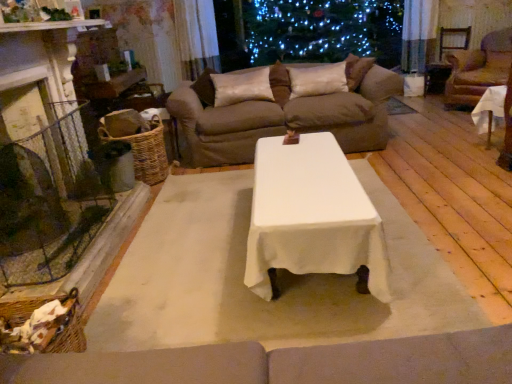
Measure the distance between brown fabric couch at upper center and camera.

brown fabric couch at upper center and camera are 11.69 feet apart.

The height and width of the screenshot is (384, 512). What do you see at coordinates (146, 153) in the screenshot?
I see `woven brown basket at left` at bounding box center [146, 153].

In order to click on satin curtain at upper center in this screenshot , I will do `click(196, 37)`.

Describe the element at coordinates (490, 111) in the screenshot. I see `white cloth-covered table at right` at that location.

Measure the distance between white cloth-covered table at right and camera.

white cloth-covered table at right and camera are 3.31 meters apart from each other.

Find the location of a particular element. This screenshot has width=512, height=384. brown leather armchair at right is located at coordinates (478, 69).

The height and width of the screenshot is (384, 512). Find the location of `brown fabric couch at upper center`. brown fabric couch at upper center is located at coordinates (283, 120).

Looking at this image, based on their positions, is brown fabric couch at upper center located to the left or right of brown leather armchair at right?

brown fabric couch at upper center is positioned on brown leather armchair at right's left side.

Is brown fabric couch at upper center looking in the opposite direction of brown leather armchair at right?

That's not correct — brown fabric couch at upper center is not looking away from brown leather armchair at right.

Considering the sizes of brown fabric couch at upper center and brown leather armchair at right in the image, is brown fabric couch at upper center taller or shorter than brown leather armchair at right?

In the image, brown fabric couch at upper center appears to be shorter than brown leather armchair at right.

Is white cloth-covered table at right in front of or behind woven brown basket at left in the image?

white cloth-covered table at right is in front of woven brown basket at left.

Based on the photo, which is more to the left, white cloth-covered table at right or woven brown basket at left?

From the viewer's perspective, woven brown basket at left appears more on the left side.

From the image's perspective, is white cloth-covered table at right over woven brown basket at left?

Indeed, from the image's perspective, white cloth-covered table at right is shown above woven brown basket at left.

Is point (504, 91) less distant than point (143, 138)?

Yes, point (504, 91) is closer to viewer.

From the image's perspective, between satin curtain at upper center and brown leather armchair at right, which one is located above?

satin curtain at upper center appears higher in the image.

Is satin curtain at upper center placed right next to brown leather armchair at right?

They are not placed beside each other.

Between satin curtain at upper center and brown leather armchair at right, which one has more height?

With more height is satin curtain at upper center.

Would you say brown fabric couch at upper center is part of brown leather armchair at right's contents?

That's incorrect, brown fabric couch at upper center is not inside brown leather armchair at right.

Measure the distance from brown leather armchair at right to brown fabric couch at upper center.

A distance of 2.45 meters exists between brown leather armchair at right and brown fabric couch at upper center.

Which is in front, brown leather armchair at right or brown fabric couch at upper center?

brown fabric couch at upper center is in front.

Between brown leather armchair at right and brown fabric couch at upper center, which one has more height?

brown leather armchair at right is taller.

Considering the positions of objects woven brown basket at left and white cloth-covered table at right in the image provided, who is in front, woven brown basket at left or white cloth-covered table at right?

white cloth-covered table at right is more forward.

Could you tell me if woven brown basket at left is turned towards white cloth-covered table at right?

Yes.

Does point (140, 150) come in front of point (488, 136)?

Yes, it is in front of point (488, 136).

Are woven brown basket at left and white cloth-covered table at right far apart?

woven brown basket at left is far away from white cloth-covered table at right.

In the image, is satin curtain at upper center positioned in front of or behind brown fabric couch at upper center?

Visually, satin curtain at upper center is located behind brown fabric couch at upper center.

Is satin curtain at upper center oriented towards brown fabric couch at upper center?

Yes, satin curtain at upper center is aimed at brown fabric couch at upper center.

Consider the image. From a real-world perspective, which object rests below the other?

brown fabric couch at upper center is physically lower.

How many degrees apart are the facing directions of satin curtain at upper center and brown fabric couch at upper center?

36.6 degrees.

Considering the relative sizes of white cloth-covered table at right and brown fabric couch at upper center in the image provided, is white cloth-covered table at right taller than brown fabric couch at upper center?

In fact, white cloth-covered table at right may be shorter than brown fabric couch at upper center.

Identify the location of table lying on the right of brown fabric couch at upper center. (490, 111).

Considering the relative sizes of white cloth-covered table at right and brown fabric couch at upper center in the image provided, is white cloth-covered table at right thinner than brown fabric couch at upper center?

Correct, the width of white cloth-covered table at right is less than that of brown fabric couch at upper center.

Does white cloth-covered table at right turn towards brown fabric couch at upper center?

Yes, white cloth-covered table at right is oriented towards brown fabric couch at upper center.

At what (x,y) coordinates should I click in order to perform the action: click on studio couch directly beneath the brown leather armchair at right (from a real-world perspective). Please return your answer as a coordinate pair (x, y). Image resolution: width=512 pixels, height=384 pixels. Looking at the image, I should click on (283, 120).

At what (x,y) coordinates should I click in order to perform the action: click on table above the woven brown basket at left (from the image's perspective). Please return your answer as a coordinate pair (x, y). This screenshot has width=512, height=384. Looking at the image, I should click on (490, 111).

When comparing their distances from satin curtain at upper center, does woven brown basket at left or satin cushion at center, the first pillow positioned from the left, seem further?

woven brown basket at left is further to satin curtain at upper center.

Based on their spatial positions, is satin curtain at upper center or silky beige pillow at center, the 1th pillow in the right-to-left sequence, further from satin cushion at center, the first pillow positioned from the left?

satin curtain at upper center.

Based on their spatial positions, is satin curtain at upper center or silky beige pillow at center, placed as the 2th pillow when sorted from left to right, further from woven brown basket at left?

satin curtain at upper center lies further to woven brown basket at left than the other object.

Considering their positions, is brown leather armchair at right positioned closer to brown fabric couch at upper center than satin curtain at upper center?

Among the two, satin curtain at upper center is located nearer to brown fabric couch at upper center.

Which object lies further to the anchor point satin cushion at center, acting as the second pillow starting from the right, silky beige pillow at center, the 1th pillow in the right-to-left sequence, or brown fabric couch at upper center?

Among the two, silky beige pillow at center, the 1th pillow in the right-to-left sequence, is located further to satin cushion at center, acting as the second pillow starting from the right.

Which object lies further to the anchor point brown fabric couch at upper center, satin cushion at center, acting as the second pillow starting from the right, or white cloth-covered table at right?

white cloth-covered table at right is further to brown fabric couch at upper center.

Considering their positions, is woven brown basket at left positioned closer to satin curtain at upper center than silky beige pillow at center, placed as the 2th pillow when sorted from left to right?

The object closer to satin curtain at upper center is silky beige pillow at center, placed as the 2th pillow when sorted from left to right.

Which object lies further to the anchor point brown fabric couch at upper center, woven brown basket at left or silky beige pillow at center, the 1th pillow in the right-to-left sequence?

Based on the image, woven brown basket at left appears to be further to brown fabric couch at upper center.

Image resolution: width=512 pixels, height=384 pixels. Find the location of `table between silky beige pillow at center, placed as the 2th pillow when sorted from left to right, and brown leather armchair at right`. table between silky beige pillow at center, placed as the 2th pillow when sorted from left to right, and brown leather armchair at right is located at coordinates (490, 111).

You are a GUI agent. You are given a task and a screenshot of the screen. Output one action in this format:
    pyautogui.click(x=<x>, y=<y>)
    Task: Click on the studio couch situated between satin cushion at center, acting as the second pillow starting from the right, and white cloth-covered table at right from left to right
    This screenshot has width=512, height=384.
    Given the screenshot: What is the action you would take?
    pyautogui.click(x=283, y=120)

Locate an element on the screen. pillow between woven brown basket at left and brown fabric couch at upper center is located at coordinates (242, 87).

You are a GUI agent. You are given a task and a screenshot of the screen. Output one action in this format:
    pyautogui.click(x=<x>, y=<y>)
    Task: Click on the pillow between satin cushion at center, acting as the second pillow starting from the right, and brown leather armchair at right, in the horizontal direction
    The image size is (512, 384).
    Given the screenshot: What is the action you would take?
    pyautogui.click(x=318, y=80)